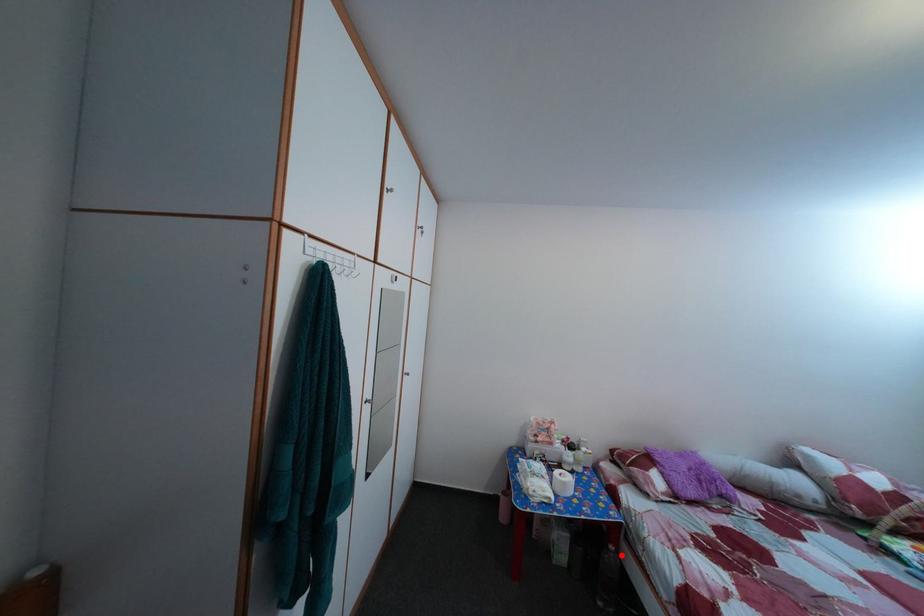
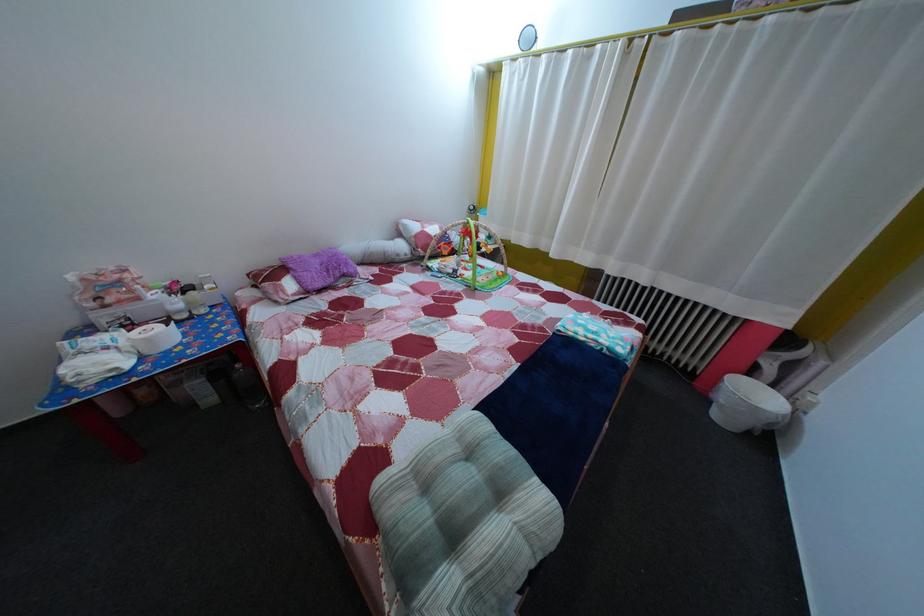
Question: I am providing you with two images of the same scene from different viewpoints. Given a red point in image1, look at the same physical point in image2. Is it:

Choices:
 (A) Closer to the viewpoint
 (B) Farther from the viewpoint

Answer: (B)